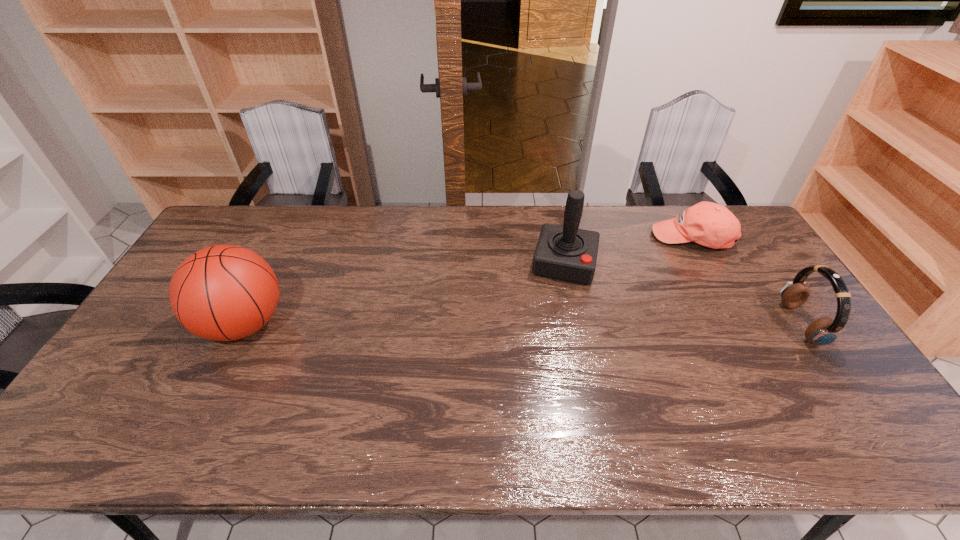
Locate an element on the screen. The width and height of the screenshot is (960, 540). empty space between the headset and the shortest object is located at coordinates [746, 281].

I want to click on vacant point located between the shortest object and the second object from left to right, so click(628, 251).

This screenshot has width=960, height=540. What are the coordinates of `blank region between the third object from left to right and the joystick` in the screenshot? It's located at (628, 251).

Locate an element on the screen. The image size is (960, 540). blank region between the shortest object and the joystick is located at coordinates (628, 251).

Image resolution: width=960 pixels, height=540 pixels. Find the location of `object that stands as the third closest to the joystick`. object that stands as the third closest to the joystick is located at coordinates (223, 292).

Select which object appears as the third closest to the leftmost object. Please provide its 2D coordinates. Your answer should be formatted as a tuple, i.e. [(x, y)], where the tuple contains the x and y coordinates of a point satisfying the conditions above.

[(823, 331)]

The width and height of the screenshot is (960, 540). I want to click on free space in the image that satisfies the following two spatial constraints: 1. on the front side of the third tallest object; 2. on the ear cup of the third object from left to right, so click(x=737, y=324).

This screenshot has height=540, width=960. Find the location of `free spot that satisfies the following two spatial constraints: 1. on the back side of the third tallest object; 2. on the ear cup of the leftmost object`. free spot that satisfies the following two spatial constraints: 1. on the back side of the third tallest object; 2. on the ear cup of the leftmost object is located at coordinates (244, 324).

The image size is (960, 540). I want to click on free region that satisfies the following two spatial constraints: 1. on the back side of the rightmost object; 2. on the ear cup of the leftmost object, so click(244, 324).

Where is `vacant area that satisfies the following two spatial constraints: 1. on the back side of the third object from right to left; 2. on the right side of the baseball cap`? vacant area that satisfies the following two spatial constraints: 1. on the back side of the third object from right to left; 2. on the right side of the baseball cap is located at coordinates (560, 239).